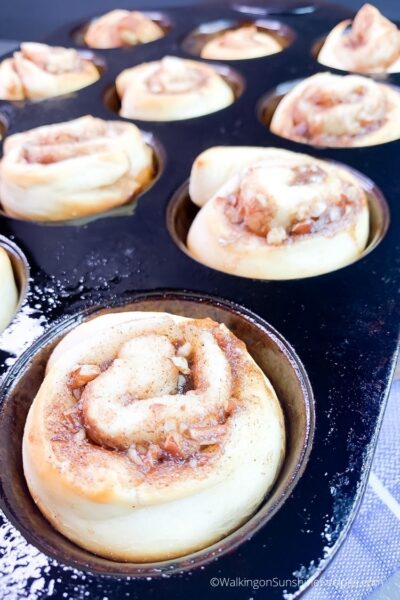
I want to click on napkin, so click(x=380, y=544).